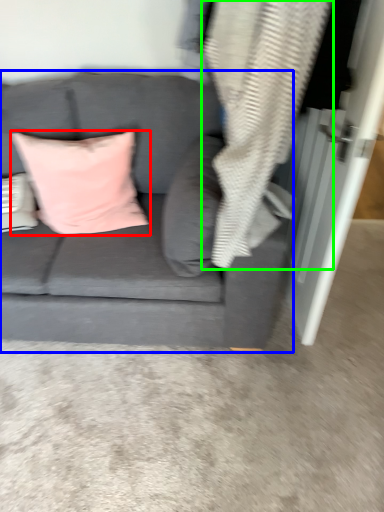
Question: Which is farther away from pillow (highlighted by a red box)? studio couch (highlighted by a blue box) or material (highlighted by a green box)?

Choices:
 (A) studio couch
 (B) material

Answer: (B)